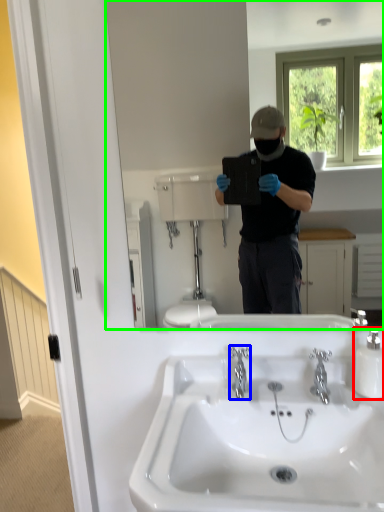
Question: Considering the real-world distances, which object is farthest from bottle (highlighted by a red box)? plumbing fixture (highlighted by a blue box) or mirror (highlighted by a green box)?

Choices:
 (A) plumbing fixture
 (B) mirror

Answer: (B)